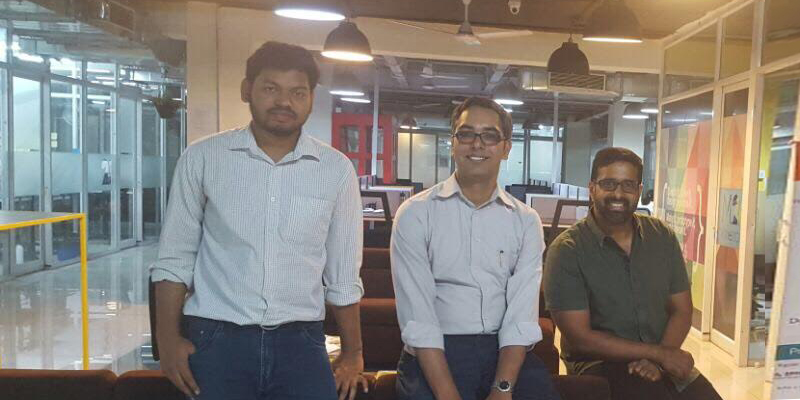
The image size is (800, 400). Find the location of `brown ceiling`. brown ceiling is located at coordinates [x=640, y=17].